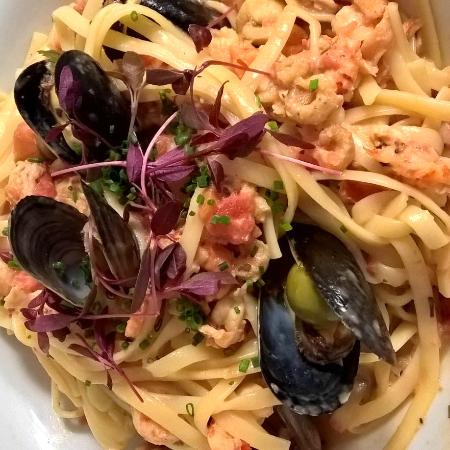
Where is `plate`? plate is located at coordinates (427, 439).